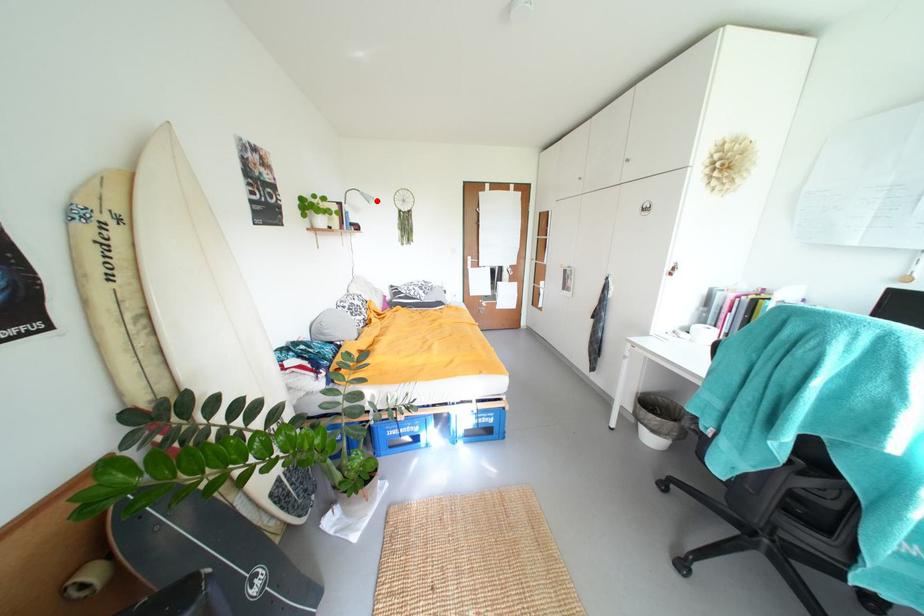
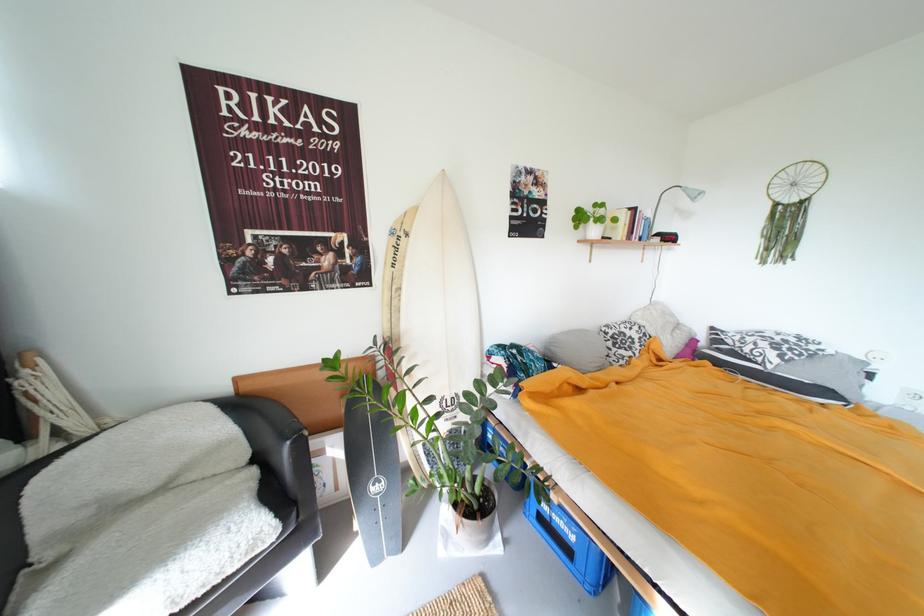
Find the pixel in the second image that matches the highlighted location in the first image.

(703, 198)